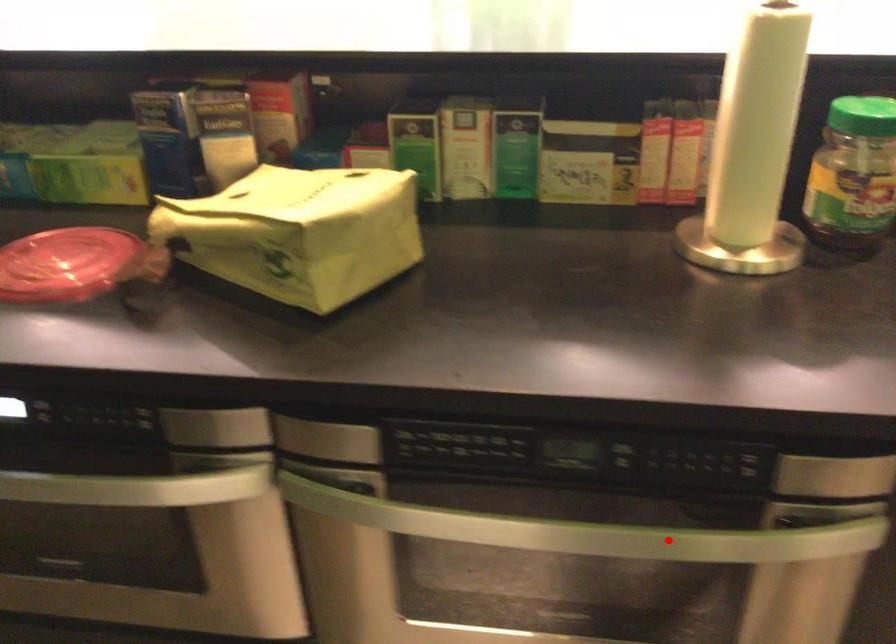
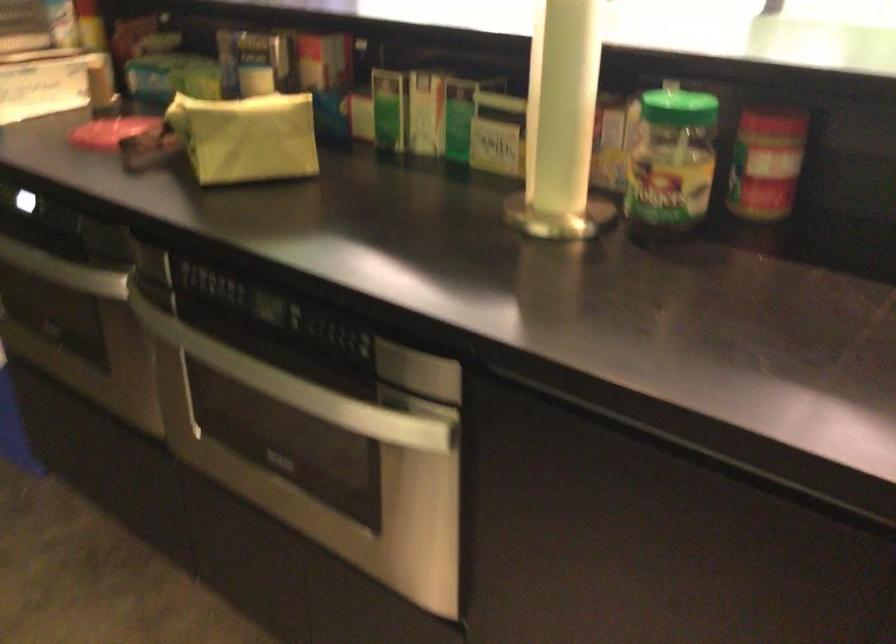
Question: I am providing you with two images of the same scene from different viewpoints. Given a red point in image1, look at the same physical point in image2. Is it:

Choices:
 (A) Closer to the viewpoint
 (B) Farther from the viewpoint

Answer: (B)